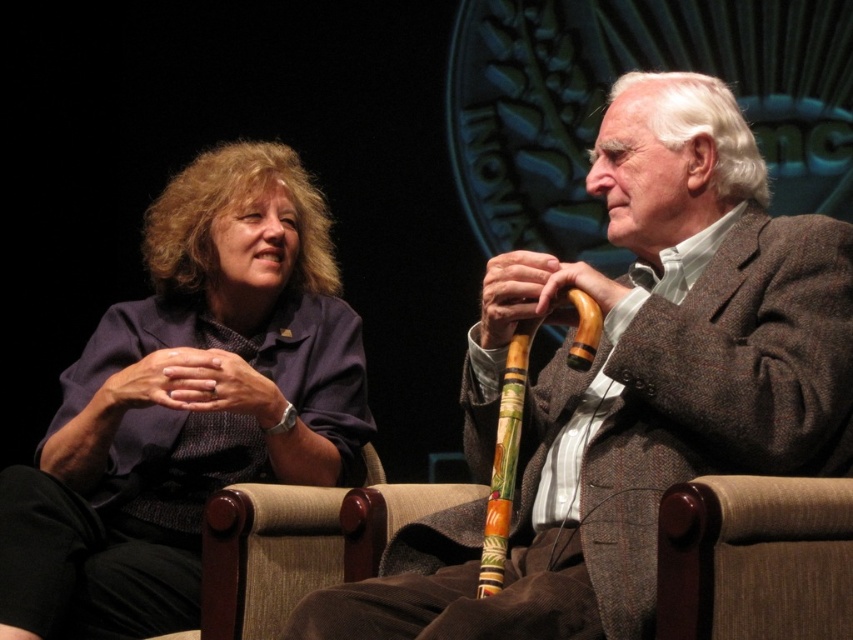
Question: Is the position of brown textured cane at center less distant than that of carved wooden cane at center?

Choices:
 (A) yes
 (B) no

Answer: (A)

Question: Among these objects, which one is nearest to the camera?

Choices:
 (A) matte purple jacket at left
 (B) carved wooden cane at center

Answer: (B)

Question: Which of the following is the farthest from the observer?

Choices:
 (A) carved wooden cane at center
 (B) matte purple jacket at left

Answer: (B)

Question: Does brown textured cane at center have a greater width compared to matte purple jacket at left?

Choices:
 (A) no
 (B) yes

Answer: (B)

Question: Does brown textured cane at center appear over matte purple jacket at left?

Choices:
 (A) yes
 (B) no

Answer: (B)

Question: Which point appears farthest from the camera in this image?

Choices:
 (A) (521, 376)
 (B) (399, 570)
 (C) (242, 147)

Answer: (C)